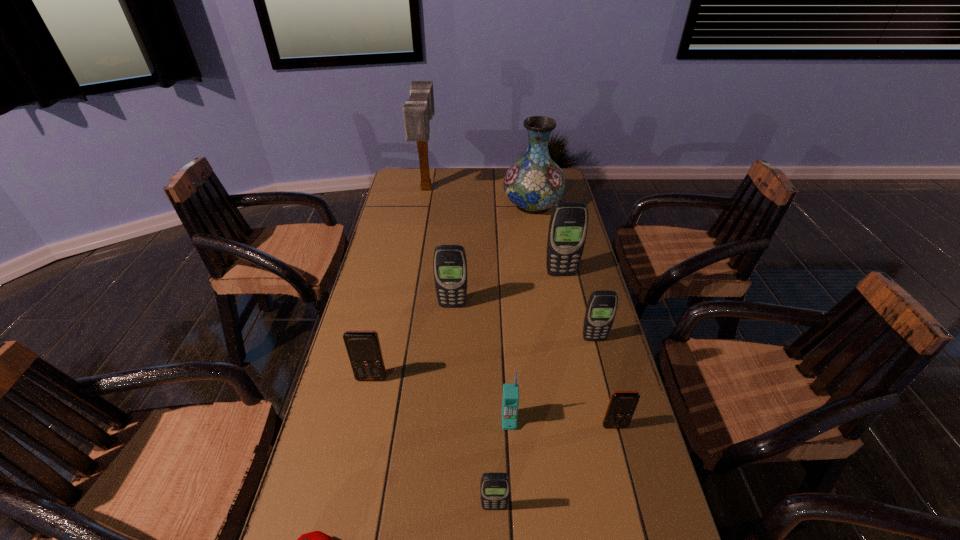
At what (x,y) coordinates should I click in order to perform the action: click on vacant region at the left edge of the desktop. Please return your answer as a coordinate pair (x, y). Image resolution: width=960 pixels, height=540 pixels. Looking at the image, I should click on (412, 204).

This screenshot has width=960, height=540. In the image, there is a desktop. What are the coordinates of `free region at the right edge` in the screenshot? It's located at (606, 448).

The height and width of the screenshot is (540, 960). In the image, there is a desktop. In order to click on free space at the far left corner in this screenshot , I will do coord(408,174).

Where is `vacant space in between the second biggest gray cellular telephone and the third biggest gray cellular telephone`? Image resolution: width=960 pixels, height=540 pixels. vacant space in between the second biggest gray cellular telephone and the third biggest gray cellular telephone is located at coordinates (523, 322).

I want to click on free area in between the leftmost cellular telephone and the mallet, so click(x=399, y=284).

Find the location of a particular element. The image size is (960, 540). free point between the mallet and the blue vase is located at coordinates (479, 197).

Where is `empty space between the third farthest gray cellular telephone and the leftmost cellular telephone`? Image resolution: width=960 pixels, height=540 pixels. empty space between the third farthest gray cellular telephone and the leftmost cellular telephone is located at coordinates (483, 359).

Where is `free space between the fifth nearest cellular telephone and the wood mallet`? The width and height of the screenshot is (960, 540). free space between the fifth nearest cellular telephone and the wood mallet is located at coordinates (511, 264).

Locate an element on the screen. The width and height of the screenshot is (960, 540). free space between the blue vase and the eighth shortest object is located at coordinates (547, 239).

The width and height of the screenshot is (960, 540). Find the location of `empty location between the farthest cellular telephone and the vase`. empty location between the farthest cellular telephone and the vase is located at coordinates (547, 239).